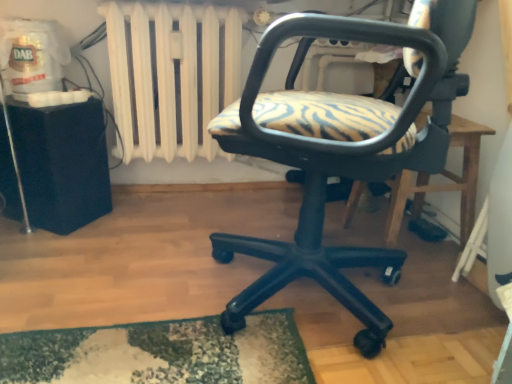
Measure the distance between point [161,153] and camera.

Point [161,153] and camera are 5.70 feet apart.

I want to click on wooden table at center, arranged as the 2th table when viewed from the left, so click(x=441, y=183).

Is matte black office chair at center in front of or behind white painted metal radiator at upper center in the image?

Visually, matte black office chair at center is located in front of white painted metal radiator at upper center.

Considering the points (381, 318) and (211, 116), which point is in front, point (381, 318) or point (211, 116)?

The point (381, 318) is more forward.

Is matte black office chair at center taller than white painted metal radiator at upper center?

Correct, matte black office chair at center is much taller as white painted metal radiator at upper center.

Could you measure the distance between matte black office chair at center and white painted metal radiator at upper center?

matte black office chair at center and white painted metal radiator at upper center are 27.43 inches apart.

From the image's perspective, which one is positioned lower, matte black office chair at center or wooden table at center, which appears as the first table when viewed from the right?

wooden table at center, which appears as the first table when viewed from the right, is shown below in the image.

Which object is thinner, matte black office chair at center or wooden table at center, arranged as the 2th table when viewed from the left?

wooden table at center, arranged as the 2th table when viewed from the left.

Does point (403, 132) lie behind point (394, 191)?

No, (403, 132) is closer to viewer.

Considering the sizes of black plastic table at left, the 2th table viewed from the right, and wooden table at center, which appears as the first table when viewed from the right, in the image, is black plastic table at left, the 2th table viewed from the right, wider or thinner than wooden table at center, which appears as the first table when viewed from the right,?

In the image, black plastic table at left, the 2th table viewed from the right, appears to be more narrow than wooden table at center, which appears as the first table when viewed from the right.

In the image, is black plastic table at left, the 2th table viewed from the right, positioned in front of or behind wooden table at center, arranged as the 2th table when viewed from the left?

Visually, black plastic table at left, the 2th table viewed from the right, is located behind wooden table at center, arranged as the 2th table when viewed from the left.

Is black plastic table at left, marked as the 1th table in a left-to-right arrangement, inside or outside of wooden table at center, arranged as the 2th table when viewed from the left?

The correct answer is: outside.

Which is in front, point (95, 169) or point (364, 183)?

The point (95, 169) is more forward.

Does point (238, 56) come behind point (347, 220)?

No.

Considering the relative sizes of white painted metal radiator at upper center and wooden table at center, which appears as the first table when viewed from the right, in the image provided, is white painted metal radiator at upper center taller than wooden table at center, which appears as the first table when viewed from the right,?

Correct, white painted metal radiator at upper center is much taller as wooden table at center, which appears as the first table when viewed from the right.

Based on the photo, between white painted metal radiator at upper center and wooden table at center, which appears as the first table when viewed from the right, which one appears on the right side from the viewer's perspective?

wooden table at center, which appears as the first table when viewed from the right.

Is wooden table at center, arranged as the 2th table when viewed from the left, oriented away from black plastic table at left, marked as the 1th table in a left-to-right arrangement?

wooden table at center, arranged as the 2th table when viewed from the left, does not have its back to black plastic table at left, marked as the 1th table in a left-to-right arrangement.

Is wooden table at center, arranged as the 2th table when viewed from the left, inside the boundaries of black plastic table at left, marked as the 1th table in a left-to-right arrangement, or outside?

wooden table at center, arranged as the 2th table when viewed from the left, is not inside black plastic table at left, marked as the 1th table in a left-to-right arrangement, it's outside.

In the image, is wooden table at center, which appears as the first table when viewed from the right, on the left side or the right side of black plastic table at left, the 2th table viewed from the right?

Based on their positions, wooden table at center, which appears as the first table when viewed from the right, is located to the right of black plastic table at left, the 2th table viewed from the right.

Who is shorter, white painted metal radiator at upper center or black plastic table at left, the 2th table viewed from the right?

Standing shorter between the two is black plastic table at left, the 2th table viewed from the right.

Is white painted metal radiator at upper center inside the boundaries of black plastic table at left, the 2th table viewed from the right, or outside?

white painted metal radiator at upper center is located beyond the bounds of black plastic table at left, the 2th table viewed from the right.

Considering the points (139, 101) and (56, 224), which point is behind, point (139, 101) or point (56, 224)?

The point (139, 101) is farther from the camera.

At what (x,y) coordinates should I click in order to perform the action: click on radiator that appears on the right of black plastic table at left, marked as the 1th table in a left-to-right arrangement. Please return your answer as a coordinate pair (x, y). Looking at the image, I should click on (172, 75).

Is white painted metal radiator at upper center taller than matte black office chair at center?

In fact, white painted metal radiator at upper center may be shorter than matte black office chair at center.

Is white painted metal radiator at upper center bigger than matte black office chair at center?

No.

Can you confirm if white painted metal radiator at upper center is thinner than matte black office chair at center?

Yes, white painted metal radiator at upper center is thinner than matte black office chair at center.

Is point (157, 41) farther from viewer compared to point (311, 257)?

Yes.

I want to click on chair to the right of white painted metal radiator at upper center, so click(338, 156).

Find the location of a particular element. chair that is above the wooden table at center, arranged as the 2th table when viewed from the left (from the image's perspective) is located at coordinates (338, 156).

Which object lies nearer to the anchor point white painted metal radiator at upper center, black plastic table at left, the 2th table viewed from the right, or matte black office chair at center?

black plastic table at left, the 2th table viewed from the right, lies closer to white painted metal radiator at upper center than the other object.

Estimate the real-world distances between objects in this image. Which object is further from black plastic table at left, the 2th table viewed from the right, white painted metal radiator at upper center or matte black office chair at center?

matte black office chair at center is further to black plastic table at left, the 2th table viewed from the right.

From the image, which object appears to be farther from matte black office chair at center, black plastic table at left, the 2th table viewed from the right, or wooden table at center, arranged as the 2th table when viewed from the left?

black plastic table at left, the 2th table viewed from the right, is further to matte black office chair at center.

Which object lies nearer to the anchor point wooden table at center, arranged as the 2th table when viewed from the left, white painted metal radiator at upper center or black plastic table at left, the 2th table viewed from the right?

white painted metal radiator at upper center.

When comparing their distances from wooden table at center, arranged as the 2th table when viewed from the left, does black plastic table at left, marked as the 1th table in a left-to-right arrangement, or white painted metal radiator at upper center seem further?

black plastic table at left, marked as the 1th table in a left-to-right arrangement, is positioned further to the anchor wooden table at center, arranged as the 2th table when viewed from the left.

When comparing their distances from white painted metal radiator at upper center, does matte black office chair at center or black plastic table at left, marked as the 1th table in a left-to-right arrangement, seem closer?

black plastic table at left, marked as the 1th table in a left-to-right arrangement.

From the image, which object appears to be nearer to wooden table at center, arranged as the 2th table when viewed from the left, matte black office chair at center or black plastic table at left, marked as the 1th table in a left-to-right arrangement?

Based on the image, matte black office chair at center appears to be nearer to wooden table at center, arranged as the 2th table when viewed from the left.

When comparing their distances from wooden table at center, which appears as the first table when viewed from the right, does matte black office chair at center or white painted metal radiator at upper center seem further?

Based on the image, white painted metal radiator at upper center appears to be further to wooden table at center, which appears as the first table when viewed from the right.

The width and height of the screenshot is (512, 384). I want to click on radiator situated between black plastic table at left, the 2th table viewed from the right, and matte black office chair at center from left to right, so click(172, 75).

I want to click on radiator between black plastic table at left, the 2th table viewed from the right, and wooden table at center, which appears as the first table when viewed from the right, so click(172, 75).

This screenshot has width=512, height=384. I want to click on chair between black plastic table at left, marked as the 1th table in a left-to-right arrangement, and wooden table at center, which appears as the first table when viewed from the right, from left to right, so click(338, 156).